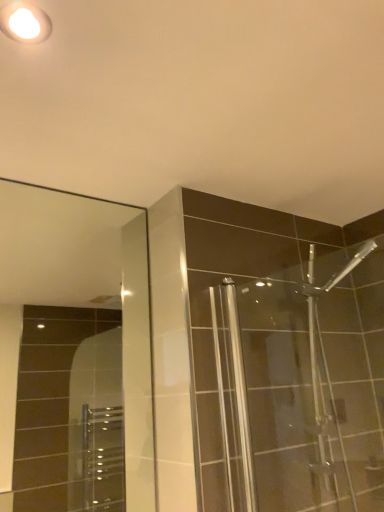
Question: Is clear glass mirror at upper left inside the boundaries of white glossy light fixture at upper left, or outside?

Choices:
 (A) outside
 (B) inside

Answer: (A)

Question: Is point (8, 413) positioned closer to the camera than point (31, 27)?

Choices:
 (A) closer
 (B) farther

Answer: (B)

Question: Is clear glass mirror at upper left bigger or smaller than white glossy light fixture at upper left?

Choices:
 (A) big
 (B) small

Answer: (A)

Question: From the image's perspective, is white glossy light fixture at upper left located above or below clear glass mirror at upper left?

Choices:
 (A) below
 (B) above

Answer: (B)

Question: Is point (3, 22) closer or farther from the camera than point (46, 324)?

Choices:
 (A) closer
 (B) farther

Answer: (A)

Question: From a real-world perspective, relative to clear glass mirror at upper left, is white glossy light fixture at upper left vertically above or below?

Choices:
 (A) below
 (B) above

Answer: (B)

Question: In the image, is white glossy light fixture at upper left positioned in front of or behind clear glass mirror at upper left?

Choices:
 (A) behind
 (B) front

Answer: (B)